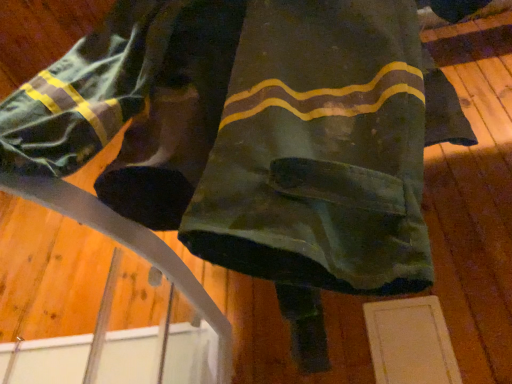
Measure the distance between point (57, 172) and camera.

The distance of point (57, 172) from camera is 22.36 inches.

The width and height of the screenshot is (512, 384). Describe the element at coordinates (254, 132) in the screenshot. I see `olive-green canvas trousers at center` at that location.

The image size is (512, 384). I want to click on olive-green canvas trousers at center, so click(x=254, y=132).

Where is `olive-green canvas trousers at center`? olive-green canvas trousers at center is located at coordinates (254, 132).